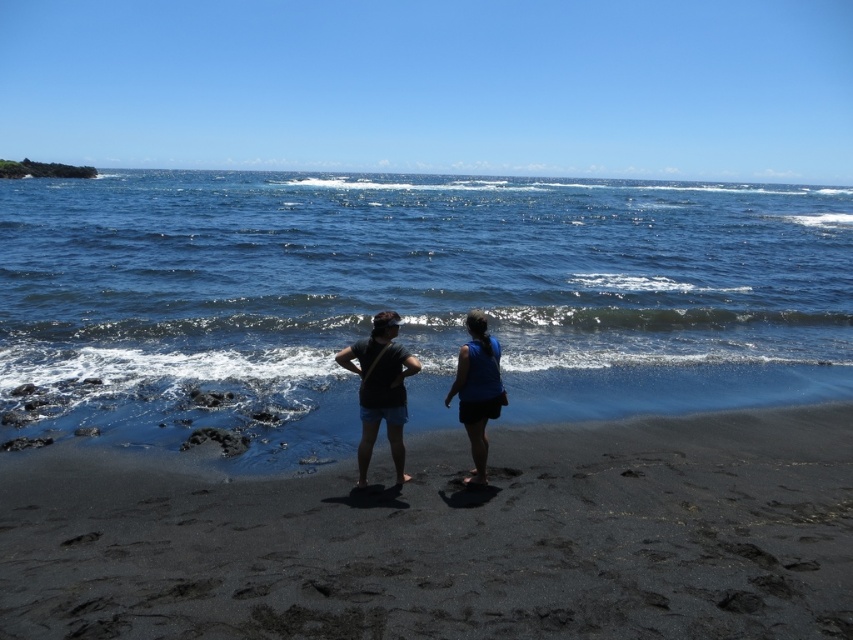
Consider the image. Does black sand at center appear on the left side of blue fabric skirt at center?

Yes, black sand at center is to the left of blue fabric skirt at center.

Is black sand at center closer to camera compared to blue fabric skirt at center?

Yes, black sand at center is in front of blue fabric skirt at center.

Is point (425, 548) in front of point (463, 365)?

Yes, it is in front of point (463, 365).

Locate an element on the screen. black sand at center is located at coordinates (448, 538).

Does black sand at center have a lesser height compared to matte black shorts at center?

Correct, black sand at center is not as tall as matte black shorts at center.

Does black sand at center lie behind matte black shorts at center?

No, black sand at center is in front of matte black shorts at center.

Which is behind, point (132, 592) or point (374, 364)?

The point (374, 364) is behind.

At what (x,y) coordinates should I click in order to perform the action: click on black sand at center. Please return your answer as a coordinate pair (x, y). The width and height of the screenshot is (853, 640). Looking at the image, I should click on (448, 538).

Does point (358, 404) lie in front of point (474, 468)?

No, it is not.

Is point (396, 342) behind point (485, 467)?

No.

What are the coordinates of `dark gray fabric shirt at center` in the screenshot? It's located at (380, 388).